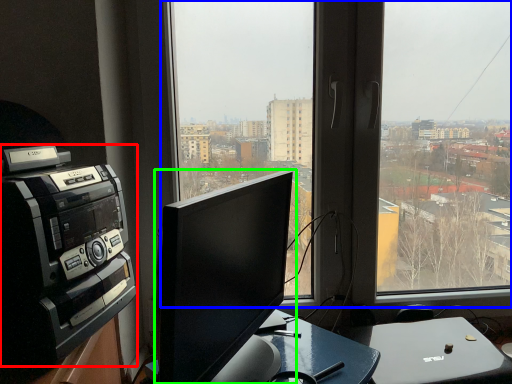
Question: Which object is positioned farthest from amplifier (highlighted by a red box)? Select from window (highlighted by a blue box) and computer monitor (highlighted by a green box).

Choices:
 (A) window
 (B) computer monitor

Answer: (A)